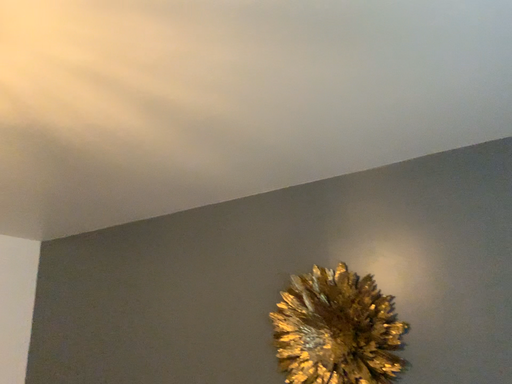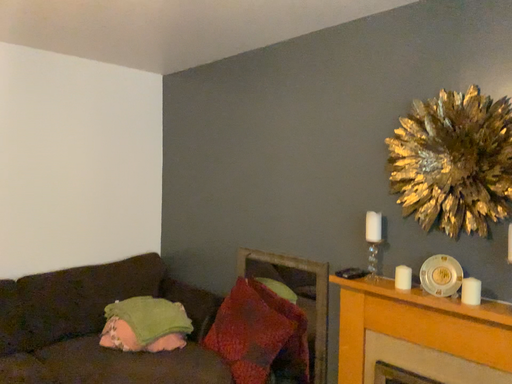
Question: How did the camera likely rotate when shooting the video?

Choices:
 (A) rotated downward
 (B) rotated upward

Answer: (A)